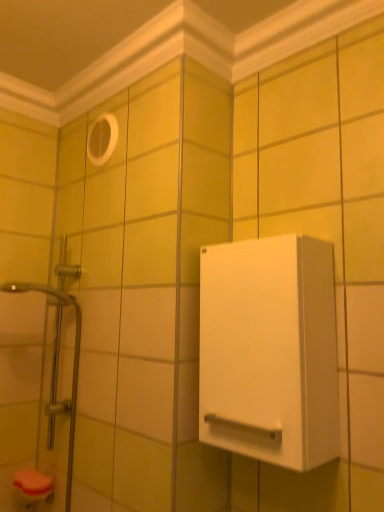
Question: From the image's perspective, is white plastic hole at upper center above or below white matte cabinet at right?

Choices:
 (A) below
 (B) above

Answer: (B)

Question: Is white plastic hole at upper center inside the boundaries of white matte cabinet at right, or outside?

Choices:
 (A) outside
 (B) inside

Answer: (A)

Question: Estimate the real-world distances between objects in this image. Which object is farther from the translucent glass shower door at left?

Choices:
 (A) white matte cabinet at right
 (B) white plastic hole at upper center

Answer: (A)

Question: Considering the real-world distances, which object is closest to the translucent glass shower door at left?

Choices:
 (A) white matte cabinet at right
 (B) white plastic hole at upper center

Answer: (B)